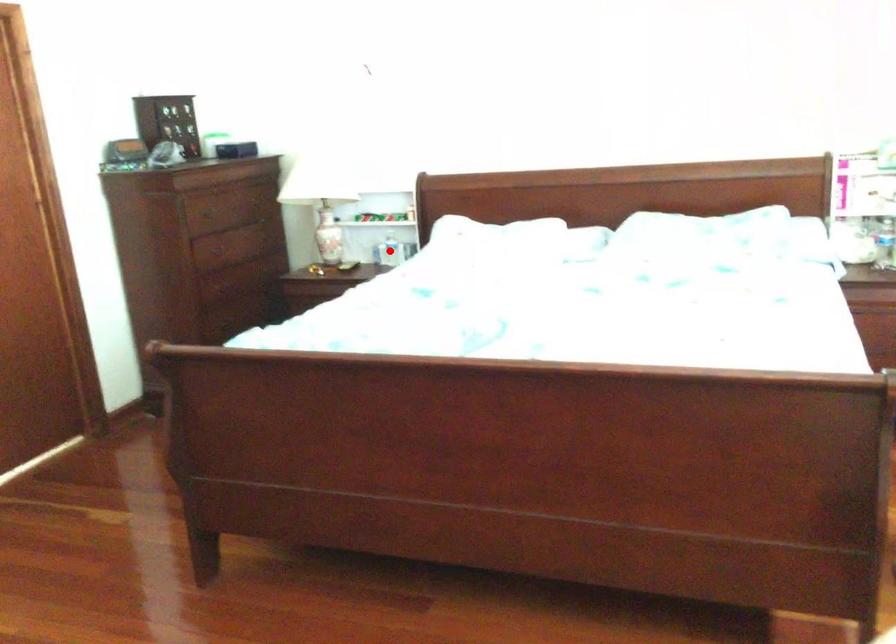
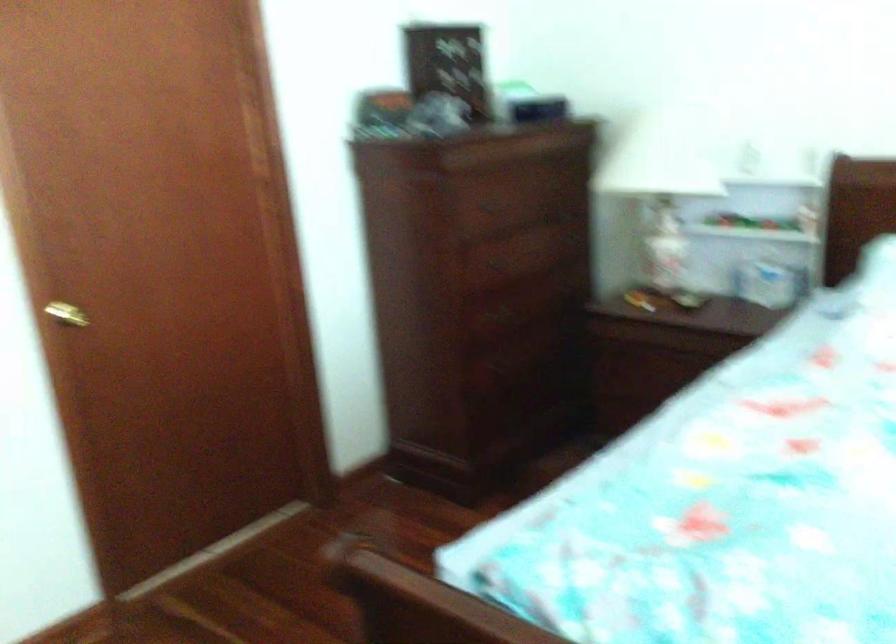
Question: I am providing you with two images of the same scene from different viewpoints. A red point is marked on the first image. Is the red point's position out of view in image 2?

Choices:
 (A) Yes
 (B) No

Answer: (A)